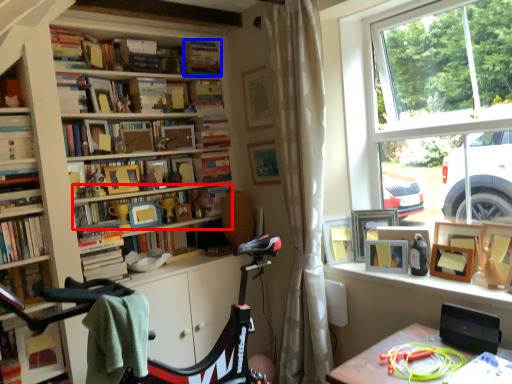
Question: Which object appears closest to the camera in this image, book (highlighted by a red box) or book (highlighted by a blue box)?

Choices:
 (A) book
 (B) book

Answer: (A)